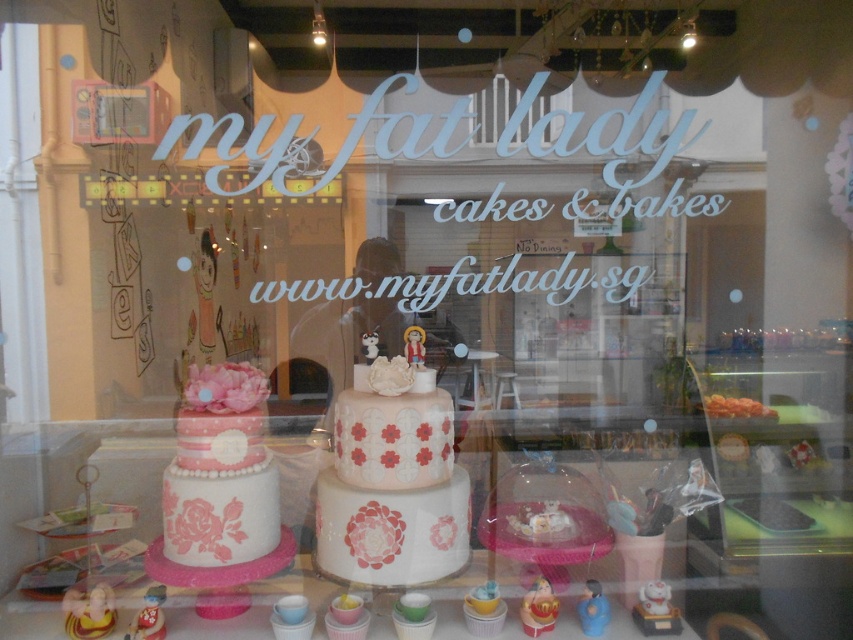
Question: Considering the relative positions of pink matte cake at center and matte pink fondant cake at center in the image provided, where is pink matte cake at center located with respect to matte pink fondant cake at center?

Choices:
 (A) left
 (B) right

Answer: (B)

Question: Which point is farther to the camera?

Choices:
 (A) (196, 429)
 (B) (341, 506)

Answer: (B)

Question: Can you confirm if pink matte cake at center is bigger than matte pink fondant cake at center?

Choices:
 (A) no
 (B) yes

Answer: (B)

Question: Where is pink matte cake at center located in relation to matte pink fondant cake at center in the image?

Choices:
 (A) left
 (B) right

Answer: (B)